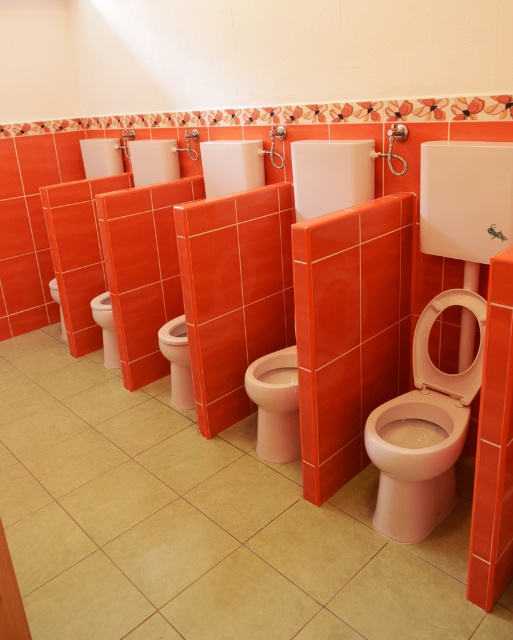
Is white glossy toilet at lower right positioned behind white glossy toilet bowl at center?

No.

Which of these two, white glossy toilet at lower right or white glossy toilet bowl at center, stands shorter?

With less height is white glossy toilet bowl at center.

Is point (405, 540) positioned behind point (183, 333)?

That is False.

Locate an element on the screen. The width and height of the screenshot is (513, 640). white glossy toilet at lower right is located at coordinates (415, 460).

Is white glossy toilet at lower right below white glossy toilet bowl at lower left?

Yes, white glossy toilet at lower right is below white glossy toilet bowl at lower left.

Between point (442, 436) and point (106, 362), which one is positioned in front?

Positioned in front is point (442, 436).

Is point (420, 476) closer to camera compared to point (110, 346)?

Yes.

Locate an element on the screen. The width and height of the screenshot is (513, 640). white glossy toilet at lower right is located at coordinates (415, 460).

Between white glossy toilet at lower right and matte white toilet at center, which one appears on the right side from the viewer's perspective?

From the viewer's perspective, white glossy toilet at lower right appears more on the right side.

Does point (459, 417) come behind point (272, 452)?

No, it is in front of (272, 452).

Who is more forward, (x=415, y=438) or (x=265, y=410)?

Point (x=415, y=438)

Find the location of a particular element. The image size is (513, 640). white glossy toilet at lower right is located at coordinates (415, 460).